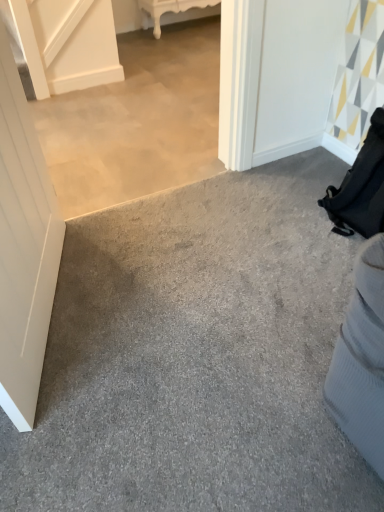
Question: Is point (56, 309) closer or farther from the camera than point (155, 18)?

Choices:
 (A) farther
 (B) closer

Answer: (B)

Question: From a real-world perspective, is gray carpet at lower right above or below white glossy table at upper center?

Choices:
 (A) below
 (B) above

Answer: (A)

Question: Based on their relative distances, which object is nearer to the gray carpet at lower right?

Choices:
 (A) white glossy table at upper center
 (B) white matte door at left

Answer: (B)

Question: Considering the real-world distances, which object is farthest from the white matte door at left?

Choices:
 (A) white glossy table at upper center
 (B) gray carpet at lower right

Answer: (A)